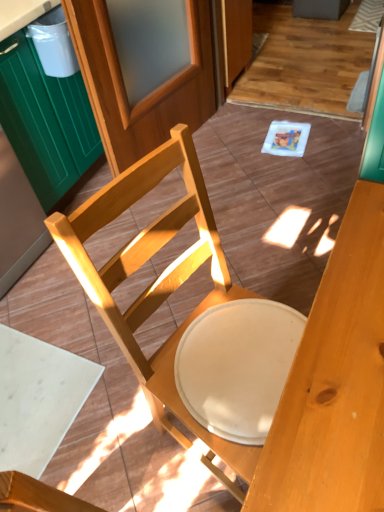
This screenshot has height=512, width=384. What are the coordinates of `empty space that is ontop of white plastic trash bin at upper left (from a real-world perspective)` in the screenshot? It's located at (53, 9).